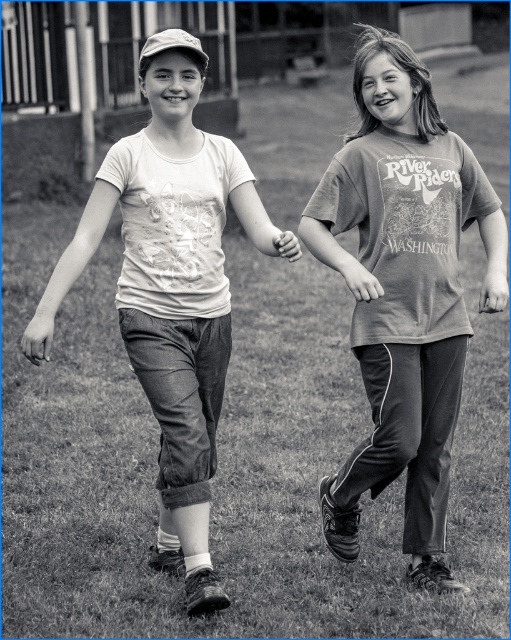
You are a photographer trying to capture the two people walking in the grassy field. You want to ensure the focus is on the grassy lawn at center where the point is located. Given that the point is at coordinates (225, 465), can you determine if the two people are positioned closer to or farther from this point compared to the blurred structure in the background?

The point at (225, 465) corresponds to the grassy lawn at center, which is where the two people are walking. Since the blurred structure is in the background, the people are closer to the point than the structure.